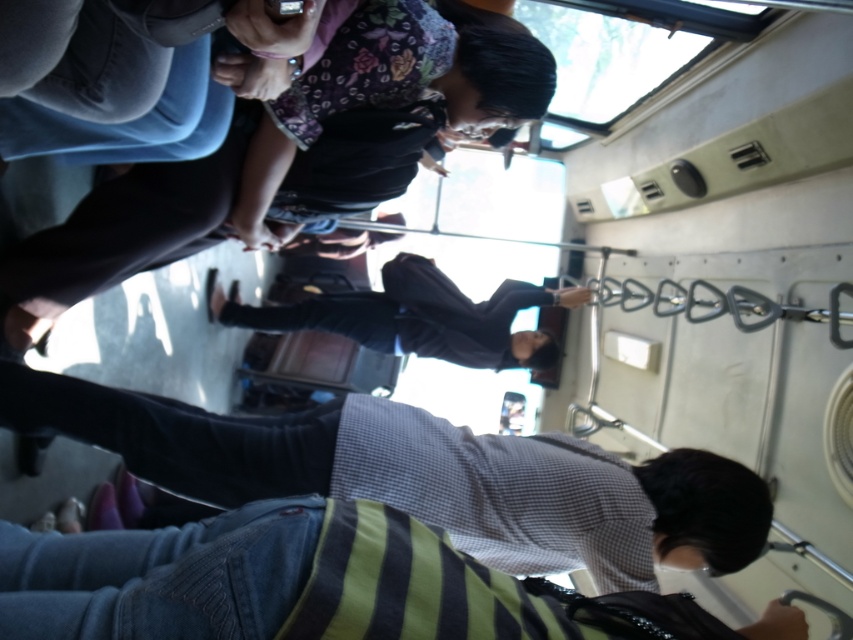
In the scene shown: You are a passenger on a bus and you see the striped sweater at lower center and the dark blue fabric jacket at center. Which item is closer to the floor?

The striped sweater at lower center is below dark blue fabric jacket at center, so the striped sweater at lower center is closer to the floor.

You are a passenger on a bus and need to exit through the door at the front of the vehicle. You see the striped shirt at lower center and the striped sweater at lower center. Which person should you move around to get to the door without blocking the aisle?

You should move around the striped sweater at lower center because it is behind the striped shirt at lower center, so moving around the striped sweater at lower center would allow you to access the front door without blocking the aisle.

You are a passenger on a bus and you see two people wearing striped clothing at the lower center of your view. The person in the striped shirt is looking to their left. Which direction should you look to see both the striped shirt at lower center and the striped sweater at lower center?

The striped shirt at lower center is to the right of the striped sweater at lower center. Since the person in the striped shirt is looking to their left, you should look to your left to see both the striped shirt at lower center and the striped sweater at lower center.